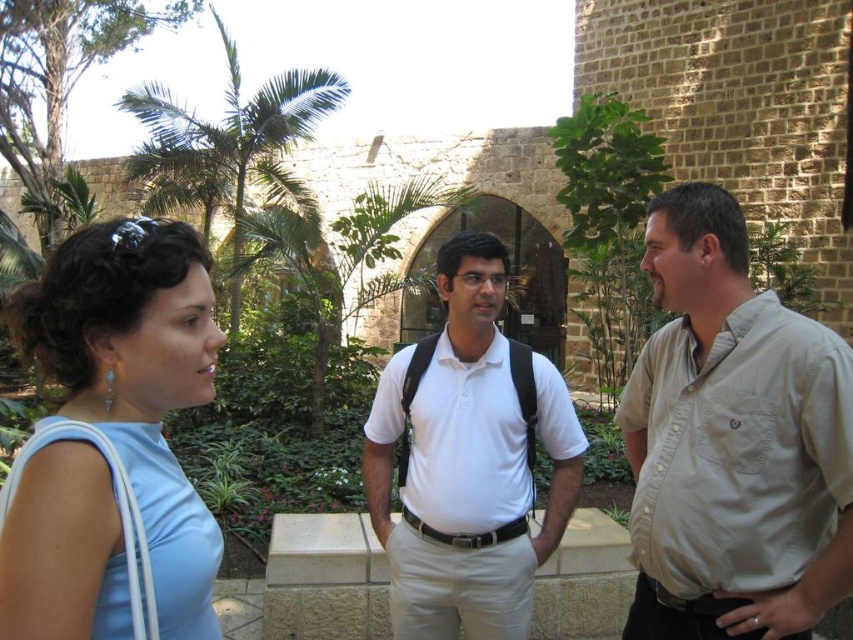
Does khaki shirt at right have a smaller size compared to white matte shirt at center?

Incorrect, khaki shirt at right is not smaller in size than white matte shirt at center.

Is khaki shirt at right to the right of white matte shirt at center from the viewer's perspective?

Yes, khaki shirt at right is to the right of white matte shirt at center.

Between point (785, 468) and point (451, 381), which one is positioned behind?

The point (451, 381) is behind.

At what (x,y) coordinates should I click in order to perform the action: click on khaki shirt at right. Please return your answer as a coordinate pair (x, y). Image resolution: width=853 pixels, height=640 pixels. Looking at the image, I should click on (732, 442).

Which is behind, point (635, 401) or point (190, 378)?

Point (635, 401)

Is khaki shirt at right to the right of light blue fabric dress at left from the viewer's perspective?

Correct, you'll find khaki shirt at right to the right of light blue fabric dress at left.

Measure the distance between khaki shirt at right and camera.

15.54 meters

What are the coordinates of `khaki shirt at right` in the screenshot? It's located at (732, 442).

Consider the image. Which of these two, matte white shirt at center or white matte shirt at center, stands taller?

Standing taller between the two is matte white shirt at center.

Is matte white shirt at center below white matte shirt at center?

No, matte white shirt at center is not below white matte shirt at center.

Who is more distant from viewer, [692,237] or [537,381]?

Positioned behind is point [537,381].

Identify the location of matte white shirt at center. (735, 442).